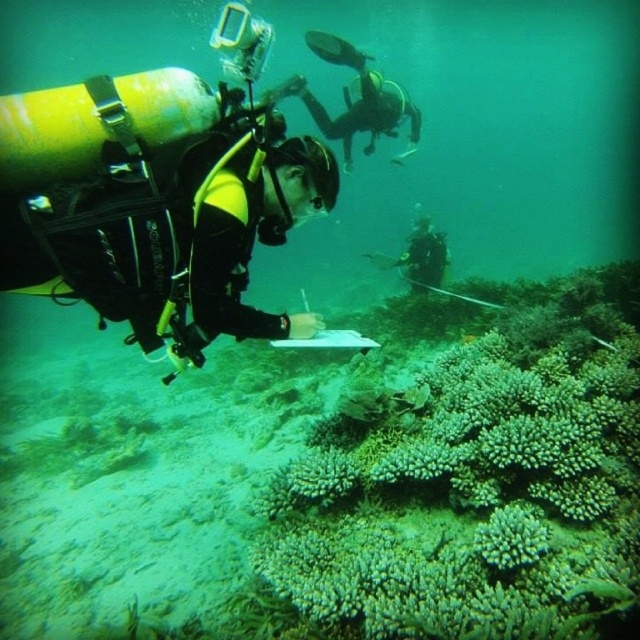
Which is more to the right, yellow matte wetsuit at center or black scuba diver at center?

black scuba diver at center is more to the right.

Find the location of `yellow matte wetsuit at center`. yellow matte wetsuit at center is located at coordinates (186, 234).

Locate an element on the screen. This screenshot has height=640, width=640. yellow matte wetsuit at center is located at coordinates (186, 234).

Can you confirm if green matte coral at center is taller than black scuba diver at center?

Incorrect, green matte coral at center's height is not larger of black scuba diver at center's.

Does green matte coral at center have a smaller size compared to black scuba diver at center?

Yes, green matte coral at center is smaller than black scuba diver at center.

Does point (525, 534) lie behind point (445, 262)?

No, (525, 534) is closer to viewer.

Image resolution: width=640 pixels, height=640 pixels. Find the location of `green matte coral at center`. green matte coral at center is located at coordinates (512, 538).

Can you confirm if yellow matte wetsuit at center is taller than green matte coral at center?

Correct, yellow matte wetsuit at center is much taller as green matte coral at center.

Image resolution: width=640 pixels, height=640 pixels. What do you see at coordinates (186, 234) in the screenshot?
I see `yellow matte wetsuit at center` at bounding box center [186, 234].

Identify the location of yellow matte wetsuit at center. (186, 234).

Where is `yellow matte wetsuit at center`? The width and height of the screenshot is (640, 640). yellow matte wetsuit at center is located at coordinates point(186,234).